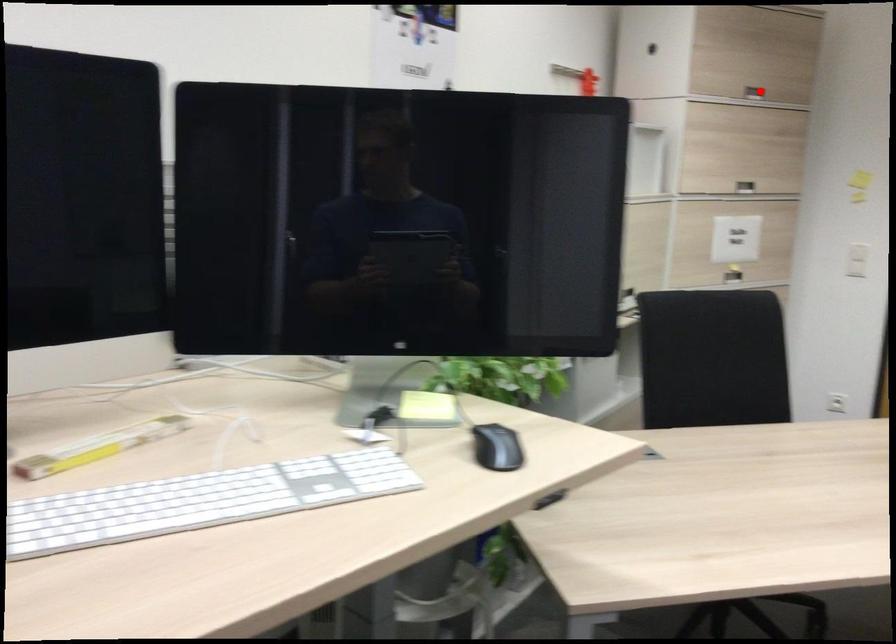
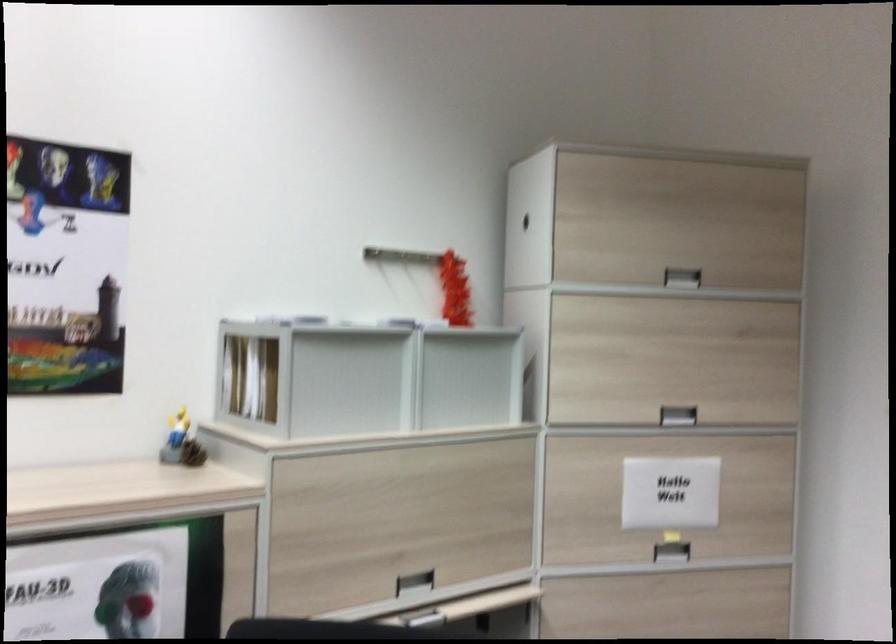
Question: I am providing you with two images of the same scene from different viewpoints. Image1 has a red point marked. In image2, the corresponding 3D location appears at what relative position? Reply with the corresponding letter.

Choices:
 (A) Closer
 (B) Farther

Answer: (A)